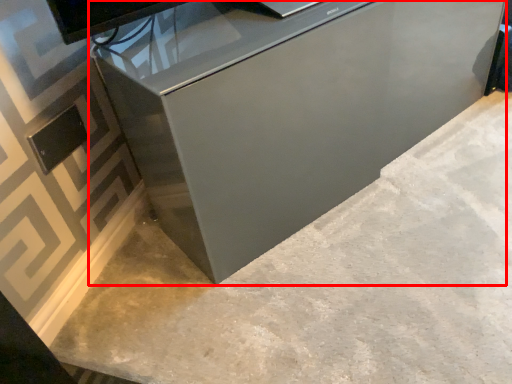
Question: From the image's perspective, where is furniture (annotated by the red box) located in relation to concrete in the image?

Choices:
 (A) above
 (B) below

Answer: (A)